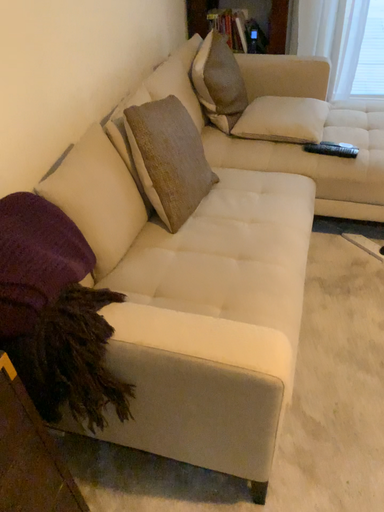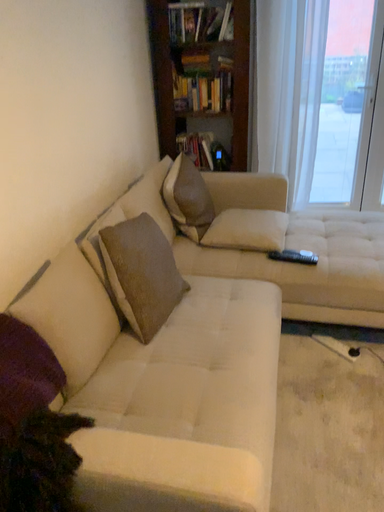
Question: Which way did the camera rotate in the video?

Choices:
 (A) rotated upward
 (B) rotated downward

Answer: (A)